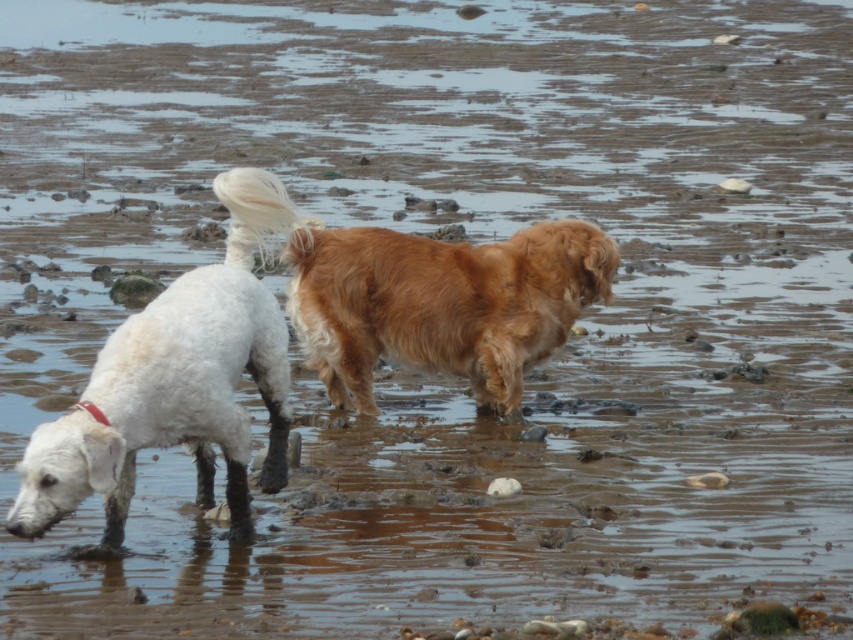
You are a photographer aiming to capture both dogs in a single frame. Given that the golden fur dog at center is wider than the white fluffy dog at left, how should you adjust your camera position to ensure both dogs are fully visible without cropping?

Since the golden fur dog at center is wider than the white fluffy dog at left, position the camera slightly closer to the golden fur dog at center to accommodate its larger width while keeping both dogs within the frame.

From the picture: You are a photographer trying to capture both the golden fur dog at center and the white fluffy dog at left in the same frame. Based on their positions, which dog should you focus on first to ensure both are in the shot?

The golden fur dog at center is above the white fluffy dog at left, so you should focus on the white fluffy dog at left first to ensure both are in the shot.

You are a photographer trying to capture both dogs in a single shot. You notice two points marked on your camera screen at coordinates point (331,320) and point (271,476). Which point is closer to you, the photographer?

Point (331,320) is further to the viewer than point (271,476), so the point closer to you is point (271,476).